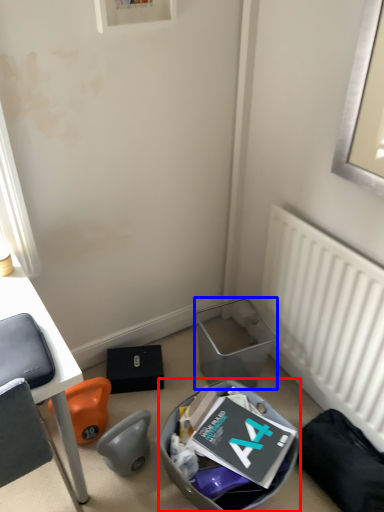
Question: Which of the following is the closest to the observer, trash bin/can (highlighted by a red box) or trash bin/can (highlighted by a blue box)?

Choices:
 (A) trash bin/can
 (B) trash bin/can

Answer: (A)